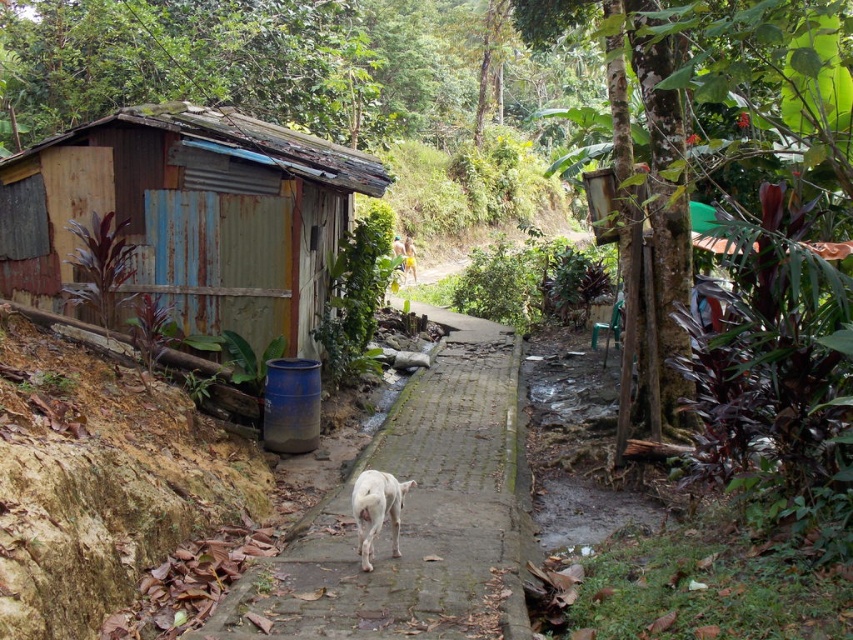
Which is below, gray concrete pavement at center or white fur dog at center?

white fur dog at center is below.

Is the position of gray concrete pavement at center less distant than that of white fur dog at center?

Yes.

You are a GUI agent. You are given a task and a screenshot of the screen. Output one action in this format:
    pyautogui.click(x=<x>, y=<y>)
    Task: Click on the gray concrete pavement at center
    This screenshot has width=853, height=640.
    Given the screenshot: What is the action you would take?
    pyautogui.click(x=410, y=516)

Which is below, rusty wood hut at left or gray concrete pavement at center?

Positioned lower is gray concrete pavement at center.

Which is more to the left, rusty wood hut at left or gray concrete pavement at center?

Positioned to the left is rusty wood hut at left.

Does point (299, 285) come farther from viewer compared to point (323, 524)?

That is True.

What are the coordinates of `rusty wood hut at left` in the screenshot? It's located at (189, 216).

Can you confirm if rusty wood hut at left is positioned to the left of white fur dog at center?

Yes, rusty wood hut at left is to the left of white fur dog at center.

Based on the photo, is rusty wood hut at left in front of white fur dog at center?

No, rusty wood hut at left is behind white fur dog at center.

Is point (41, 280) farther from viewer compared to point (370, 532)?

Yes, it is behind point (370, 532).

Where is `rusty wood hut at left`? Image resolution: width=853 pixels, height=640 pixels. rusty wood hut at left is located at coordinates (189, 216).